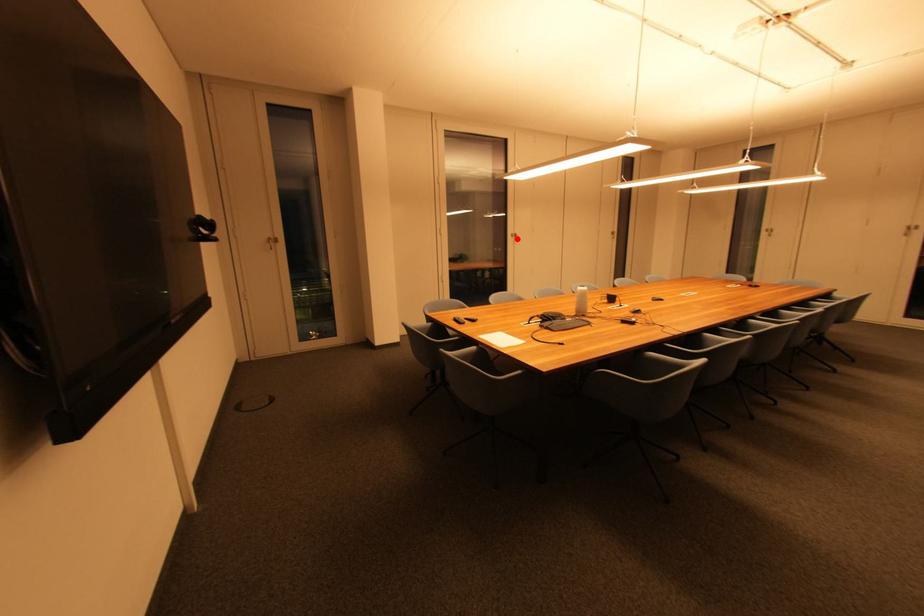
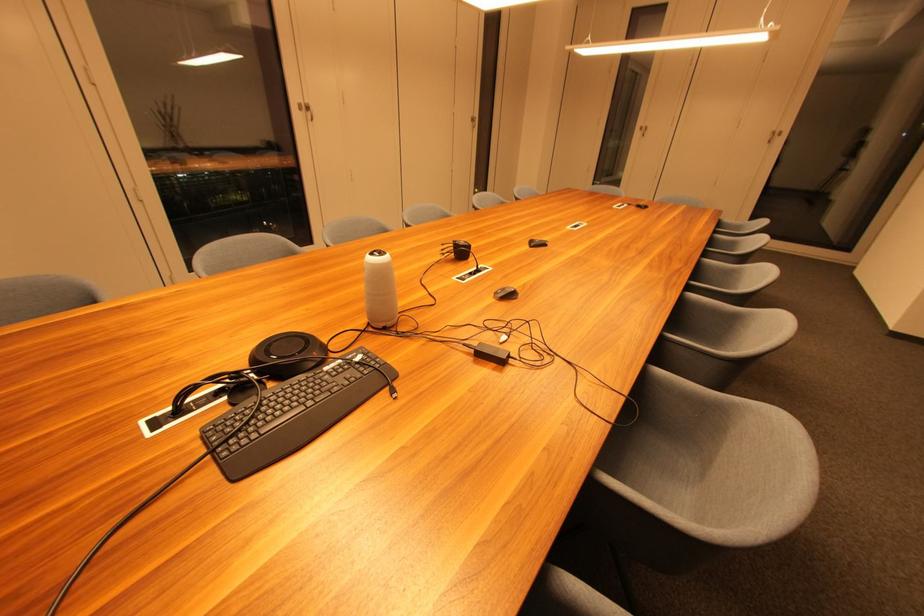
The point at the highlighted location is marked in the first image. Where is the corresponding point in the second image?

(306, 111)